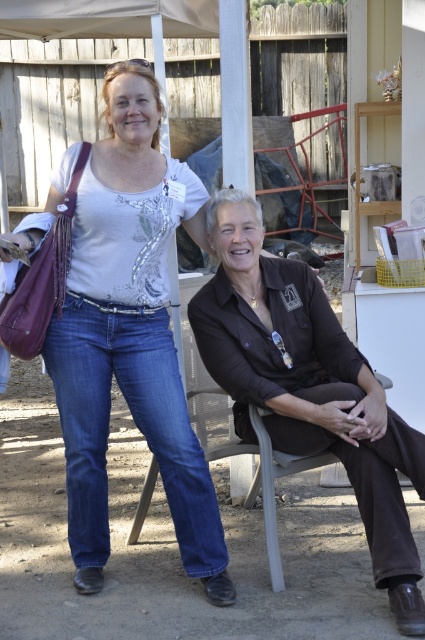
From the picture: Who is more forward, (192, 504) or (141, 330)?

Point (192, 504) is more forward.

Find the location of a particular element. denim jeans at left is located at coordinates (130, 336).

Where is `denim jeans at left`? Image resolution: width=425 pixels, height=640 pixels. denim jeans at left is located at coordinates (130, 336).

Locate an element on the screen. The image size is (425, 640). denim jeans at left is located at coordinates (130, 336).

Describe the element at coordinates (130, 336) in the screenshot. I see `denim jeans at left` at that location.

Is point (85, 266) positioned behind point (365, 522)?

Yes, it is.

The image size is (425, 640). What do you see at coordinates (130, 336) in the screenshot?
I see `denim jeans at left` at bounding box center [130, 336].

You are a GUI agent. You are given a task and a screenshot of the screen. Output one action in this format:
    pyautogui.click(x=<x>, y=<y>)
    Task: Click on the denim jeans at left
    This screenshot has height=640, width=425.
    Given the screenshot: What is the action you would take?
    pyautogui.click(x=130, y=336)

Can you confirm if brown matte shirt at center is bigger than denim jeans at lower left?

Correct, brown matte shirt at center is larger in size than denim jeans at lower left.

Who is more forward, (280, 273) or (261, 456)?

Point (261, 456) is in front.

Locate an element on the screen. Image resolution: width=425 pixels, height=640 pixels. brown matte shirt at center is located at coordinates (308, 387).

Identify the location of brown matte shirt at center. The height and width of the screenshot is (640, 425). (308, 387).